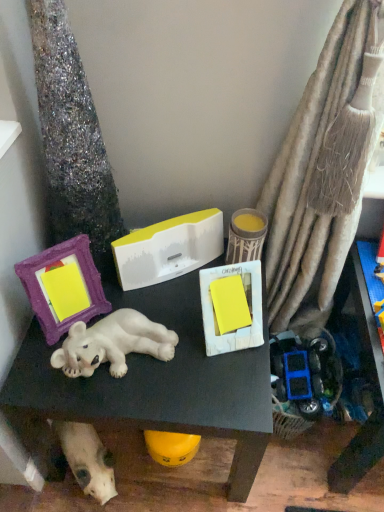
Question: Is purple fabric picture frame at left to the left or to the right of white matte dog at lower left in the image?

Choices:
 (A) left
 (B) right

Answer: (A)

Question: In terms of width, does purple fabric picture frame at left look wider or thinner when compared to white matte dog at lower left?

Choices:
 (A) wide
 (B) thin

Answer: (B)

Question: Which object is positioned farthest from the white glossy polar bear at center?

Choices:
 (A) matte yellow candle at center
 (B) white matte dog at lower left
 (C) sparkly silver tree trunk at left
 (D) purple fabric picture frame at left

Answer: (A)

Question: Which of these objects is positioned closest to the purple fabric picture frame at left?

Choices:
 (A) white matte dog at lower left
 (B) matte yellow candle at center
 (C) sparkly silver tree trunk at left
 (D) white glossy polar bear at center

Answer: (C)